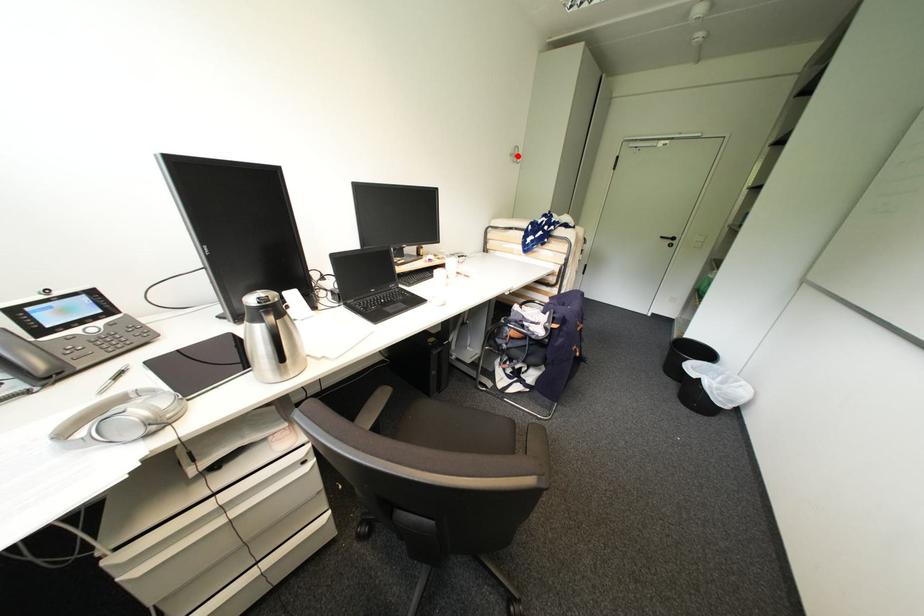
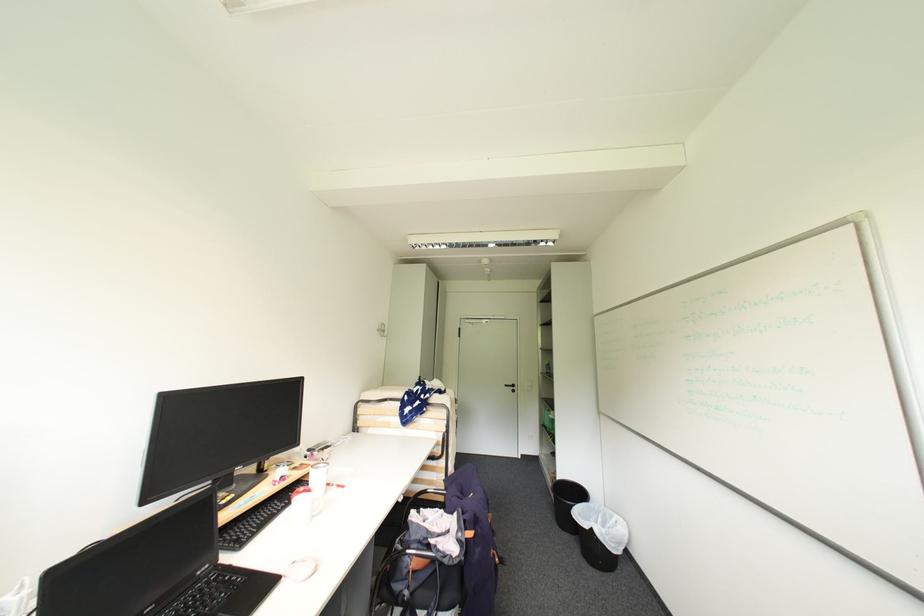
The point at the highlighted location is marked in the first image. Where is the corresponding point in the second image?

(384, 331)